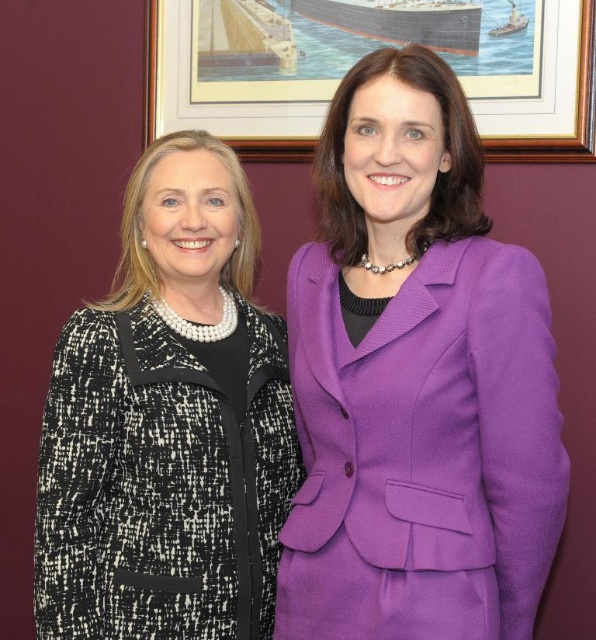
Is point (315, 620) farther from camera compared to point (122, 458)?

No.

Can you confirm if purple woolen suit at center is positioned below black textured blazer at left?

Actually, purple woolen suit at center is above black textured blazer at left.

The height and width of the screenshot is (640, 596). I want to click on purple woolen suit at center, so (417, 381).

Does black textured blazer at left have a greater height compared to wooden frame at upper center?

Yes, black textured blazer at left is taller than wooden frame at upper center.

Who is lower down, black textured blazer at left or wooden frame at upper center?

black textured blazer at left is below.

Based on the photo, measure the distance between black textured blazer at left and camera.

black textured blazer at left and camera are 1.34 meters apart from each other.

Identify the location of black textured blazer at left. This screenshot has height=640, width=596. (169, 422).

Between point (458, 104) and point (150, 116), which one is positioned in front?

Point (458, 104) is in front.

Which of these two, purple woolen suit at center or wooden frame at upper center, stands taller?

purple woolen suit at center is taller.

You are a GUI agent. You are given a task and a screenshot of the screen. Output one action in this format:
    pyautogui.click(x=<x>, y=<y>)
    Task: Click on the purple woolen suit at center
    The image size is (596, 640).
    Given the screenshot: What is the action you would take?
    pyautogui.click(x=417, y=381)

I want to click on purple woolen suit at center, so click(x=417, y=381).